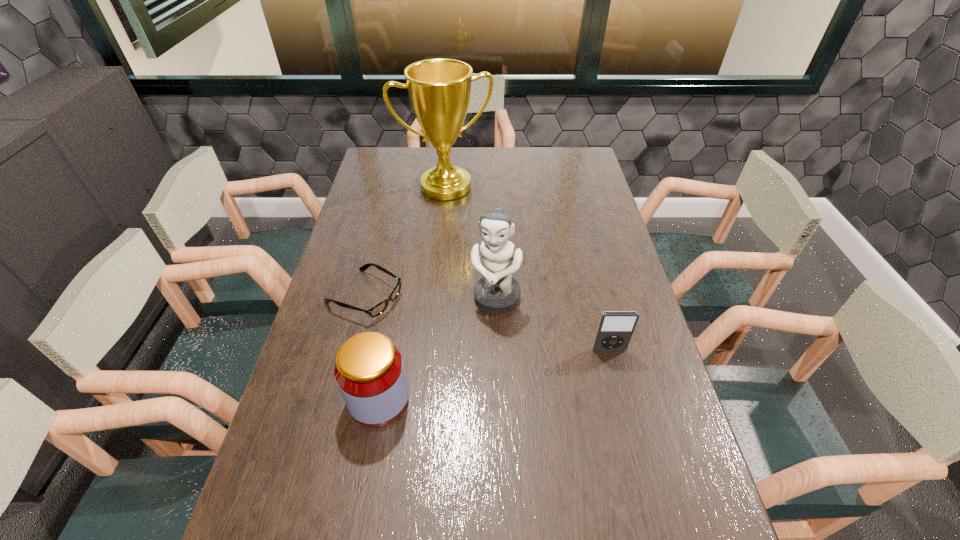
Locate which object ranks fourth in proximity to the rightmost object. Please provide its 2D coordinates. Your answer should be formatted as a tuple, i.e. [(x, y)], where the tuple contains the x and y coordinates of a point satisfying the conditions above.

[(439, 90)]

You are a GUI agent. You are given a task and a screenshot of the screen. Output one action in this format:
    pyautogui.click(x=<x>, y=<y>)
    Task: Click on the free space that satisfies the following two spatial constraints: 1. on the back side of the nearest object; 2. on the right side of the second tallest object
    This screenshot has width=960, height=540.
    Given the screenshot: What is the action you would take?
    pyautogui.click(x=396, y=299)